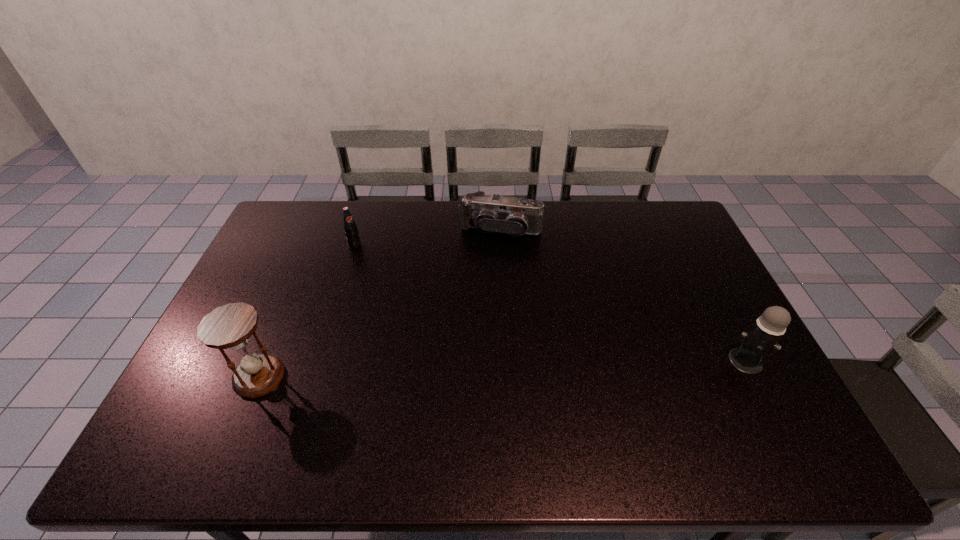
At what (x,y) coordinates should I click in order to perform the action: click on vacant area between the rightmost object and the pop. Please return your answer as a coordinate pair (x, y). Looking at the image, I should click on (550, 303).

I want to click on object that stands as the closest to the pop, so click(x=488, y=213).

Point out which object is positioned as the nearest to the third object from right to left. Please provide its 2D coordinates. Your answer should be formatted as a tuple, i.e. [(x, y)], where the tuple contains the x and y coordinates of a point satisfying the conditions above.

[(488, 213)]